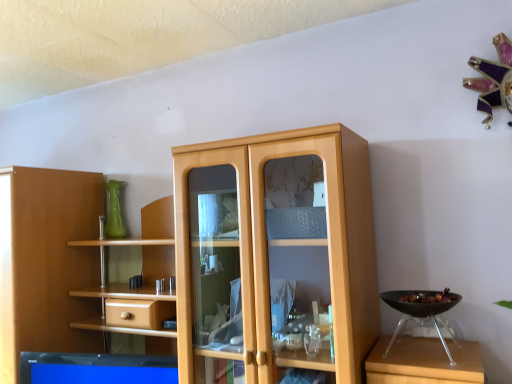
Question: Is green glass vase at upper left outside light wood cupboard at center?

Choices:
 (A) no
 (B) yes

Answer: (A)

Question: Is green glass vase at upper left turned away from light wood cupboard at center?

Choices:
 (A) yes
 (B) no

Answer: (A)

Question: Considering the relative sizes of green glass vase at upper left and light wood cupboard at center in the image provided, is green glass vase at upper left wider than light wood cupboard at center?

Choices:
 (A) yes
 (B) no

Answer: (B)

Question: Is green glass vase at upper left oriented towards light wood cupboard at center?

Choices:
 (A) yes
 (B) no

Answer: (A)

Question: Can you confirm if green glass vase at upper left is smaller than light wood cupboard at center?

Choices:
 (A) yes
 (B) no

Answer: (A)

Question: From a real-world perspective, is green glass vase at upper left on top of light wood cupboard at center?

Choices:
 (A) no
 (B) yes

Answer: (B)

Question: Is light wood cupboard at center at the back of black plastic bowl at right?

Choices:
 (A) no
 (B) yes

Answer: (A)

Question: From a real-world perspective, is black plastic bowl at right physically below light wood cupboard at center?

Choices:
 (A) yes
 (B) no

Answer: (A)

Question: Is black plastic bowl at right in contact with light wood cupboard at center?

Choices:
 (A) yes
 (B) no

Answer: (B)

Question: Is black plastic bowl at right at the left side of light wood cupboard at center?

Choices:
 (A) yes
 (B) no

Answer: (B)

Question: From a real-world perspective, is black plastic bowl at right over light wood cupboard at center?

Choices:
 (A) yes
 (B) no

Answer: (B)

Question: Does black plastic bowl at right lie behind light wood cupboard at center?

Choices:
 (A) no
 (B) yes

Answer: (B)

Question: Is green glass vase at upper left at the right side of black plastic bowl at right?

Choices:
 (A) yes
 (B) no

Answer: (B)